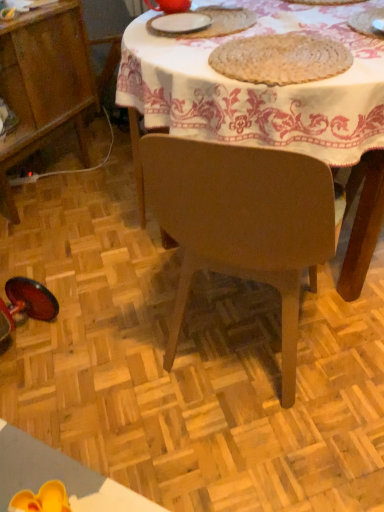
I want to click on vacant space that's between white matte plate at upper center, the 2th tableware in the left-to-right sequence, and brown woven placemat at upper center, so click(211, 44).